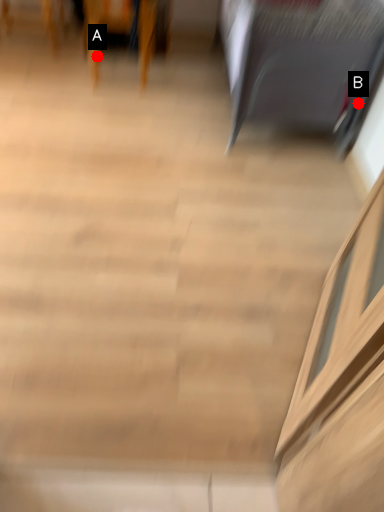
Question: Two points are circled on the image, labeled by A and B beside each circle. Which point is closer to the camera?

Choices:
 (A) A is closer
 (B) B is closer

Answer: (B)